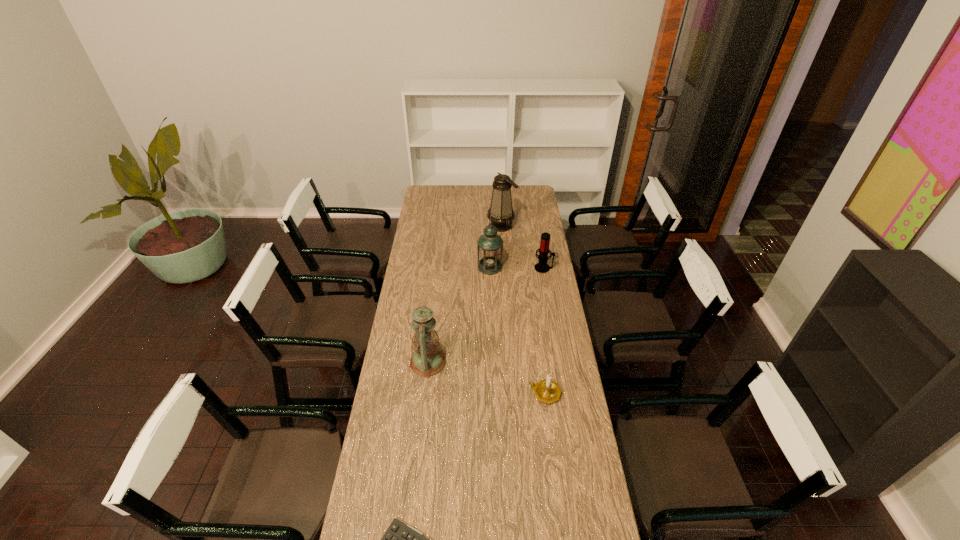
The width and height of the screenshot is (960, 540). Find the location of `free space between the farthest object and the microphone`. free space between the farthest object and the microphone is located at coordinates (522, 247).

This screenshot has height=540, width=960. I want to click on free space between the leftmost oil lamp and the farthest oil lamp, so click(465, 294).

Identify the location of unoccupied area between the second nearest oil lamp and the fourth tallest object. The width and height of the screenshot is (960, 540). (516, 267).

Identify which object is the third closest to the third shortest object. Please provide its 2D coordinates. Your answer should be formatted as a tuple, i.e. [(x, y)], where the tuple contains the x and y coordinates of a point satisfying the conditions above.

[(427, 360)]

The height and width of the screenshot is (540, 960). I want to click on object that stands as the fifth closest to the farthest object, so [399, 539].

Where is `oil lamp that can be found as the second closest to the computer keyboard`? Image resolution: width=960 pixels, height=540 pixels. oil lamp that can be found as the second closest to the computer keyboard is located at coordinates pos(490,245).

Image resolution: width=960 pixels, height=540 pixels. Find the location of `the third closest oil lamp relative to the candle holder`. the third closest oil lamp relative to the candle holder is located at coordinates (501, 212).

Locate an element on the screen. vacant space that satisfies the following two spatial constraints: 1. on the back side of the nearest oil lamp; 2. on the right side of the farthest object is located at coordinates (444, 225).

This screenshot has width=960, height=540. Find the location of `vacant space that satisfies the following two spatial constraints: 1. on the back side of the second nearest oil lamp; 2. on the left side of the farthest object`. vacant space that satisfies the following two spatial constraints: 1. on the back side of the second nearest oil lamp; 2. on the left side of the farthest object is located at coordinates (489, 225).

In order to click on vacant position in the image that satisfies the following two spatial constraints: 1. on the back side of the second farthest oil lamp; 2. on the left side of the farthest oil lamp in this screenshot , I will do `click(489, 225)`.